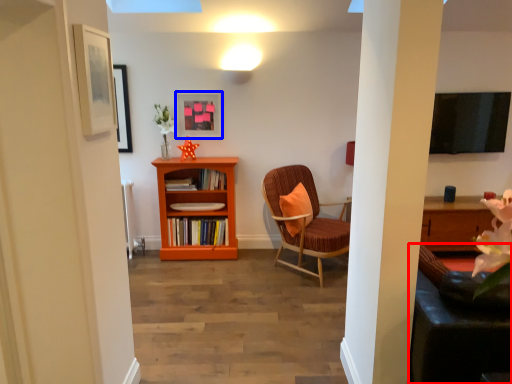
Question: Among these objects, which one is nearest to the camera, swivel chair (highlighted by a red box) or picture frame (highlighted by a blue box)?

Choices:
 (A) swivel chair
 (B) picture frame

Answer: (A)